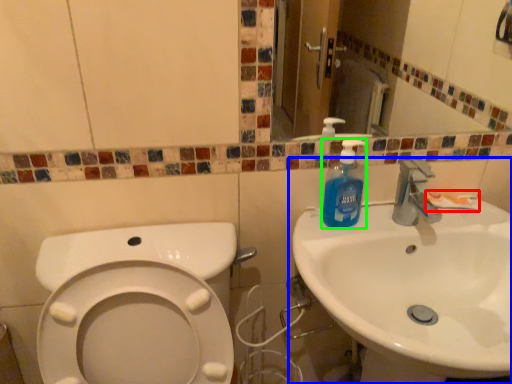
Question: Which object is the farthest from toothpaste (highlighted by a red box)? Choose among these: sink (highlighted by a blue box) or cleaning product (highlighted by a green box).

Choices:
 (A) sink
 (B) cleaning product

Answer: (A)